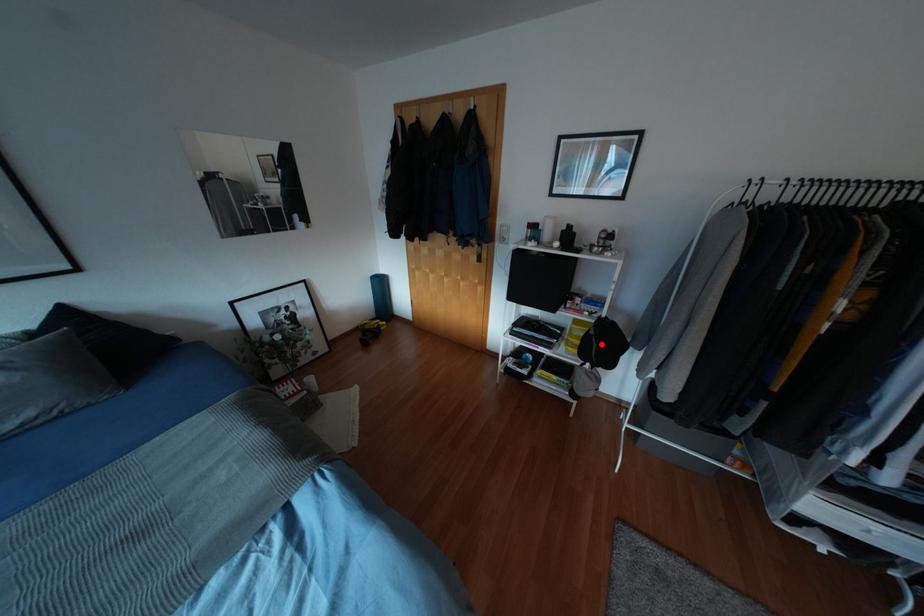
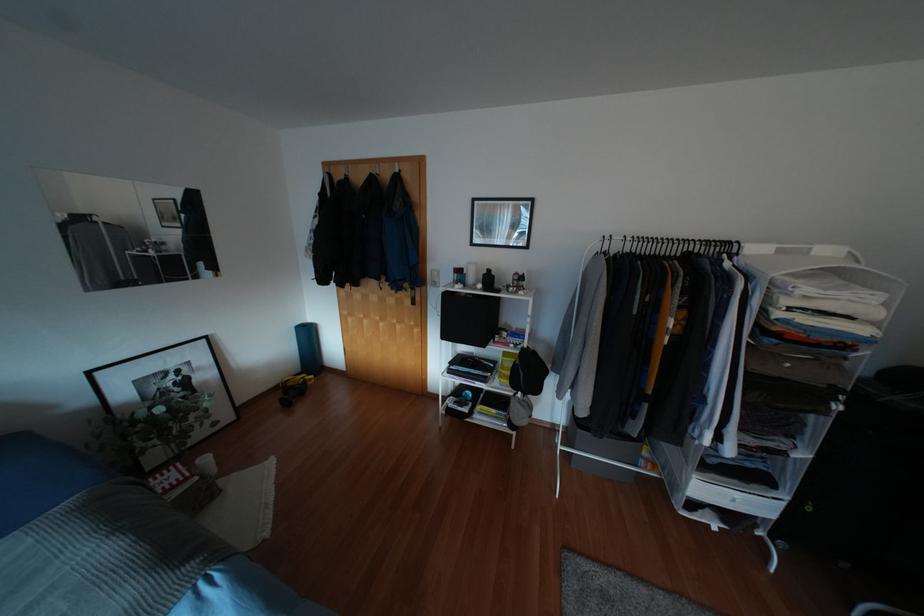
Where in the second image is the point corresponding to the highlighted location from the first image?

(528, 371)